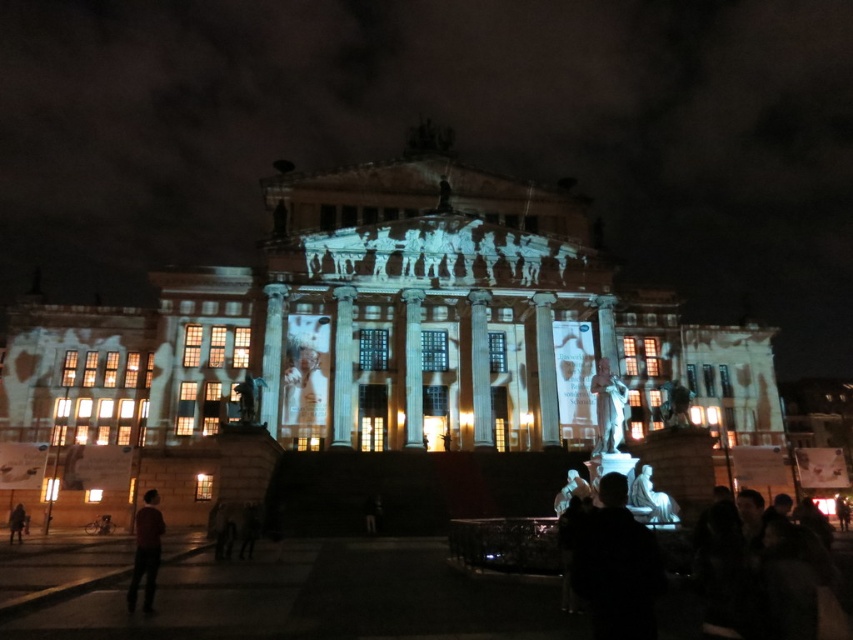
You are standing in front of the grand classical building at night. You notice the dark red sweater at lower left and the polished bronze statue at center. Which object is closer to you, the observer?

The dark red sweater at lower left is closer to you because it is in front of the polished bronze statue at center.

You are standing in front of the grand classical building at night. You see two points marked on the facade. The first point is at coordinates point (x=606, y=358) and the second is at point (x=648, y=502). From your perspective, which point is closer to you?

Point (x=648, y=502) is closer to you because it is in front of point (x=606, y=358).